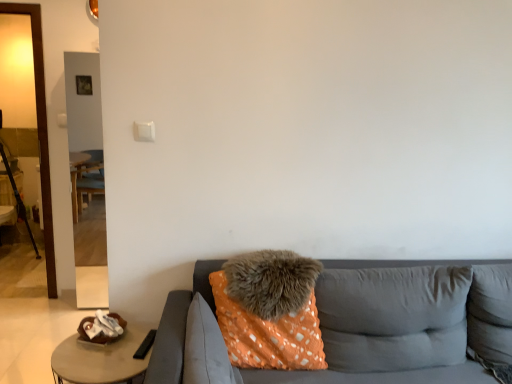
Locate an element on the screen. The width and height of the screenshot is (512, 384). wooden round table at lower left is located at coordinates click(x=100, y=359).

Describe the element at coordinates (40, 131) in the screenshot. I see `transparent glass door at left` at that location.

Identify the location of transparent glass door at left. (40, 131).

Describe the element at coordinates (177, 327) in the screenshot. I see `orange fabric couch at center` at that location.

This screenshot has width=512, height=384. Identify the location of orange fuzzy pillow at center, placed as the fourth pillow when sorted from right to left. click(268, 334).

What do you see at coordinates (490, 313) in the screenshot? Image resolution: width=512 pixels, height=384 pixels. I see `gray fabric pillow at right, which is counted as the 5th pillow, starting from the left` at bounding box center [490, 313].

Find the location of a particular element. orange dotted fabric pillow at center, the 1th pillow in the left-to-right sequence is located at coordinates (206, 348).

I want to click on wooden round table at lower left, so click(100, 359).

From a real-world perspective, is wooden round table at lower left on black metal tripod at left?

Actually, wooden round table at lower left is physically below black metal tripod at left in the real world.

Is there a large distance between wooden round table at lower left and black metal tripod at left?

Yes, wooden round table at lower left and black metal tripod at left are located far from each other.

I want to click on table on the right of black metal tripod at left, so click(100, 359).

At what (x,y) coordinates should I click in order to perform the action: click on glass door located above the gray fabric pillow at right, which is counted as the 5th pillow, starting from the left (from a real-world perspective). Please return your answer as a coordinate pair (x, y). The height and width of the screenshot is (384, 512). Looking at the image, I should click on (40, 131).

Does point (57, 295) appear closer or farther from the camera than point (503, 344)?

Point (57, 295) appears to be farther away from the viewer than point (503, 344).

From the picture: Between transparent glass door at left and gray fabric pillow at right, the first pillow in the right-to-left sequence, which one appears on the left side from the viewer's perspective?

transparent glass door at left.

Which is farther from the camera, (267, 266) or (37, 66)?

Point (37, 66)

How far apart are fuzzy gray pillow at center, the third pillow from the left, and transparent glass door at left?

They are 6.64 feet apart.

Considering the sizes of objects fuzzy gray pillow at center, which is the 3th pillow in right-to-left order, and transparent glass door at left in the image provided, who is thinner, fuzzy gray pillow at center, which is the 3th pillow in right-to-left order, or transparent glass door at left?

fuzzy gray pillow at center, which is the 3th pillow in right-to-left order, is thinner.

Does fuzzy gray pillow at center, the third pillow from the left, lie in front of transparent glass door at left?

Yes, fuzzy gray pillow at center, the third pillow from the left, is closer to the camera.

Looking at this image, between orange fabric pillow at center, which is the 2th pillow in right-to-left order, and black metal tripod at left, which one has smaller size?

With smaller size is orange fabric pillow at center, which is the 2th pillow in right-to-left order.

Consider the image. Is orange fabric pillow at center, the 4th pillow positioned from the left, not within black metal tripod at left?

Absolutely, orange fabric pillow at center, the 4th pillow positioned from the left, is external to black metal tripod at left.

Which is behind, point (375, 333) or point (24, 222)?

The point (24, 222) is more distant.

Looking at their sizes, would you say orange fabric pillow at center, the 4th pillow positioned from the left, is wider or thinner than black metal tripod at left?

Clearly, orange fabric pillow at center, the 4th pillow positioned from the left, has less width compared to black metal tripod at left.

Considering the relative sizes of wooden round table at lower left and gray fabric pillow at right, which is counted as the 5th pillow, starting from the left, in the image provided, is wooden round table at lower left taller than gray fabric pillow at right, which is counted as the 5th pillow, starting from the left,?

In fact, wooden round table at lower left may be shorter than gray fabric pillow at right, which is counted as the 5th pillow, starting from the left.

How distant is wooden round table at lower left from gray fabric pillow at right, the first pillow in the right-to-left sequence?

A distance of 1.53 meters exists between wooden round table at lower left and gray fabric pillow at right, the first pillow in the right-to-left sequence.

From a real-world perspective, which object stands above the other?

gray fabric pillow at right, the first pillow in the right-to-left sequence.

Is fuzzy gray pillow at center, which is the 3th pillow in right-to-left order, completely or partially outside of orange fabric couch at center?

Actually, fuzzy gray pillow at center, which is the 3th pillow in right-to-left order, is within orange fabric couch at center.

Can you see fuzzy gray pillow at center, the third pillow from the left, touching orange fabric couch at center?

fuzzy gray pillow at center, the third pillow from the left, and orange fabric couch at center are clearly separated.

Which point is more forward, [214,296] or [179,374]?

The point [179,374] is closer.

Based on their sizes in the image, would you say fuzzy gray pillow at center, the third pillow from the left, is bigger or smaller than orange fabric couch at center?

In the image, fuzzy gray pillow at center, the third pillow from the left, appears to be smaller than orange fabric couch at center.

Is orange fuzzy pillow at center, placed as the fourth pillow when sorted from right to left, further to camera compared to gray fabric pillow at right, the first pillow in the right-to-left sequence?

That is False.

How much distance is there between orange fuzzy pillow at center, placed as the fourth pillow when sorted from right to left, and gray fabric pillow at right, which is counted as the 5th pillow, starting from the left?

The distance of orange fuzzy pillow at center, placed as the fourth pillow when sorted from right to left, from gray fabric pillow at right, which is counted as the 5th pillow, starting from the left, is 32.74 inches.

How different are the orientations of orange fuzzy pillow at center, placed as the fourth pillow when sorted from right to left, and gray fabric pillow at right, which is counted as the 5th pillow, starting from the left, in degrees?

orange fuzzy pillow at center, placed as the fourth pillow when sorted from right to left, and gray fabric pillow at right, which is counted as the 5th pillow, starting from the left, are facing 8.77 degrees away from each other.

Where is `pillow that is the 2nd one below the gray fabric pillow at right, which is counted as the 5th pillow, starting from the left (from a real-world perspective)`? pillow that is the 2nd one below the gray fabric pillow at right, which is counted as the 5th pillow, starting from the left (from a real-world perspective) is located at coordinates (268, 334).

Locate an element on the screen. Image resolution: width=512 pixels, height=384 pixels. table located below the black metal tripod at left (from the image's perspective) is located at coordinates (100, 359).

Which pillow is the 1st one when counting from the front of the transparent glass door at left? Please provide its 2D coordinates.

[(490, 313)]

Considering their positions, is gray fabric pillow at right, which is counted as the 5th pillow, starting from the left, positioned further to black metal tripod at left than orange fabric pillow at center, the 4th pillow positioned from the left?

The object further to black metal tripod at left is gray fabric pillow at right, which is counted as the 5th pillow, starting from the left.

Estimate the real-world distances between objects in this image. Which object is further from fuzzy gray pillow at center, which is the 3th pillow in right-to-left order, orange fuzzy pillow at center, placed as the fourth pillow when sorted from right to left, or orange fabric couch at center?

Among the two, orange fabric couch at center is located further to fuzzy gray pillow at center, which is the 3th pillow in right-to-left order.

Looking at this image, looking at the image, which one is located closer to wooden round table at lower left, orange fabric pillow at center, which is the 2th pillow in right-to-left order, or orange fuzzy pillow at center, placed as the fourth pillow when sorted from right to left?

The object closer to wooden round table at lower left is orange fuzzy pillow at center, placed as the fourth pillow when sorted from right to left.

From the image, which object appears to be nearer to fuzzy gray pillow at center, the third pillow from the left, orange fabric pillow at center, the 4th pillow positioned from the left, or gray fabric pillow at right, the first pillow in the right-to-left sequence?

orange fabric pillow at center, the 4th pillow positioned from the left, lies closer to fuzzy gray pillow at center, the third pillow from the left, than the other object.

Which object lies nearer to the anchor point gray fabric pillow at right, which is counted as the 5th pillow, starting from the left, fuzzy gray pillow at center, which is the 3th pillow in right-to-left order, or orange dotted fabric pillow at center, the 1th pillow in the left-to-right sequence?

Based on the image, fuzzy gray pillow at center, which is the 3th pillow in right-to-left order, appears to be nearer to gray fabric pillow at right, which is counted as the 5th pillow, starting from the left.

Based on their spatial positions, is fuzzy gray pillow at center, the third pillow from the left, or gray fabric pillow at right, which is counted as the 5th pillow, starting from the left, further from orange dotted fabric pillow at center, the 1th pillow in the left-to-right sequence?

gray fabric pillow at right, which is counted as the 5th pillow, starting from the left.

Based on their spatial positions, is wooden round table at lower left or orange fabric couch at center closer to transparent glass door at left?

Based on the image, wooden round table at lower left appears to be nearer to transparent glass door at left.

Estimate the real-world distances between objects in this image. Which object is further from transparent glass door at left, orange fabric couch at center or fuzzy gray pillow at center, which is the 3th pillow in right-to-left order?

The object further to transparent glass door at left is fuzzy gray pillow at center, which is the 3th pillow in right-to-left order.

The width and height of the screenshot is (512, 384). In order to click on table between black metal tripod at left and gray fabric pillow at right, which is counted as the 5th pillow, starting from the left, from left to right in this screenshot , I will do `click(100, 359)`.

I want to click on studio couch between black metal tripod at left and gray fabric pillow at right, the first pillow in the right-to-left sequence, so click(x=177, y=327).

The height and width of the screenshot is (384, 512). In order to click on studio couch situated between orange dotted fabric pillow at center, which appears as the fifth pillow when viewed from the right, and gray fabric pillow at right, which is counted as the 5th pillow, starting from the left, from left to right in this screenshot , I will do `click(177, 327)`.

Where is `glass door situated between black metal tripod at left and orange fabric couch at center from left to right`? Image resolution: width=512 pixels, height=384 pixels. glass door situated between black metal tripod at left and orange fabric couch at center from left to right is located at coordinates (40, 131).